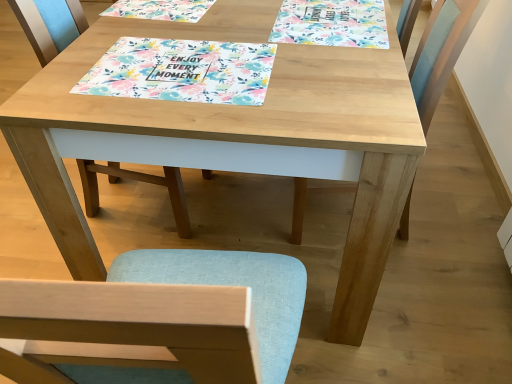
Question: Is the position of light blue fabric chair at center, the first chair in the left-to-right sequence, less distant than that of floral paper placemat at center?

Choices:
 (A) no
 (B) yes

Answer: (A)

Question: From a real-world perspective, is light blue fabric chair at center, the second chair when ordered from right to left, on floral paper placemat at center?

Choices:
 (A) no
 (B) yes

Answer: (A)

Question: Is floral paper placemat at center inside light blue fabric chair at center, the first chair in the left-to-right sequence?

Choices:
 (A) no
 (B) yes

Answer: (A)

Question: Does light blue fabric chair at center, the first chair in the left-to-right sequence, appear on the right side of floral paper placemat at center?

Choices:
 (A) no
 (B) yes

Answer: (A)

Question: Is light blue fabric chair at center, the second chair when ordered from right to left, oriented towards floral paper placemat at center?

Choices:
 (A) no
 (B) yes

Answer: (A)

Question: Is light blue fabric chair at center, the first chair in the left-to-right sequence, far away from floral paper placemat at center?

Choices:
 (A) yes
 (B) no

Answer: (B)

Question: From a real-world perspective, does floral paper placemat at center stand above light blue fabric chair at right, the 2th chair when ordered from left to right?

Choices:
 (A) no
 (B) yes

Answer: (B)

Question: Considering the relative sizes of floral paper placemat at center and light blue fabric chair at right, the 2th chair when ordered from left to right, in the image provided, is floral paper placemat at center taller than light blue fabric chair at right, the 2th chair when ordered from left to right,?

Choices:
 (A) yes
 (B) no

Answer: (B)

Question: Is floral paper placemat at center thinner than light blue fabric chair at right, which is the first chair from right to left?

Choices:
 (A) yes
 (B) no

Answer: (A)

Question: Can light blue fabric chair at right, which is the first chair from right to left, be found inside floral paper placemat at center?

Choices:
 (A) no
 (B) yes

Answer: (A)

Question: Is floral paper placemat at center aimed at light blue fabric chair at right, the 2th chair when ordered from left to right?

Choices:
 (A) yes
 (B) no

Answer: (B)

Question: Is the position of floral paper placemat at center more distant than that of light blue fabric chair at right, the 2th chair when ordered from left to right?

Choices:
 (A) yes
 (B) no

Answer: (B)

Question: Is floral paper placemat at upper center far away from floral paper placemat at center?

Choices:
 (A) yes
 (B) no

Answer: (B)